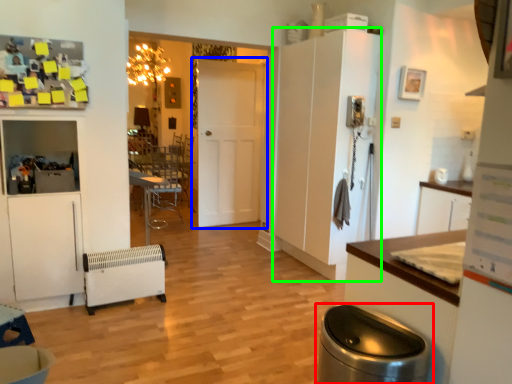
Question: Which object is the farthest from waste container (highlighted by a red box)? Choose among these: door (highlighted by a blue box) or cabinetry (highlighted by a green box).

Choices:
 (A) door
 (B) cabinetry

Answer: (A)